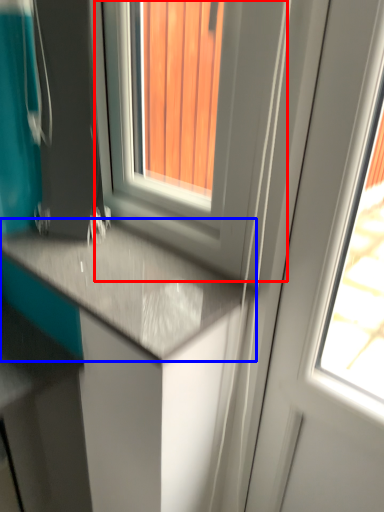
Question: Which object appears closest to the camera in this image, window (highlighted by a red box) or countertop (highlighted by a blue box)?

Choices:
 (A) window
 (B) countertop

Answer: (A)